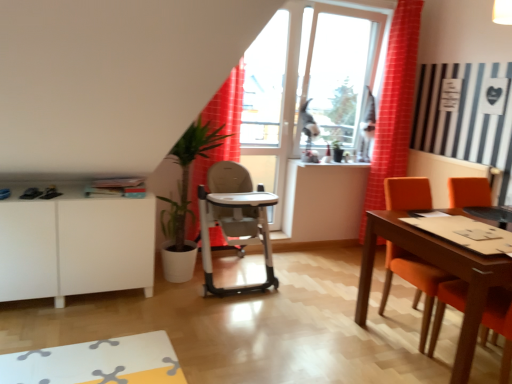
What do you see at coordinates (413, 281) in the screenshot? I see `matte orange chair at right` at bounding box center [413, 281].

Describe the element at coordinates (188, 177) in the screenshot. The height and width of the screenshot is (384, 512). I see `green leafy plant at center` at that location.

This screenshot has height=384, width=512. Describe the element at coordinates (337, 71) in the screenshot. I see `transparent glass window at center` at that location.

The width and height of the screenshot is (512, 384). I want to click on silver metallic highchair at center, so click(x=234, y=221).

In order to click on matte orange chair at right in this screenshot , I will do `click(413, 281)`.

Is white matte cabinet at lower left completely or partially outside of transparent glass window at center?

Yes, white matte cabinet at lower left is outside of transparent glass window at center.

Based on the photo, considering the relative sizes of white matte cabinet at lower left and transparent glass window at center in the image provided, is white matte cabinet at lower left thinner than transparent glass window at center?

No.

Considering the positions of point (48, 237) and point (340, 136), is point (48, 237) closer or farther from the camera than point (340, 136)?

Point (48, 237) is closer to the camera than point (340, 136).

Looking at this image, does white matte cabinet at lower left come behind transparent glass window at center?

That is False.

Is red checkered curtain at right, which is the 1th curtain from right to left, at the right side of green leafy plant at center?

Yes, red checkered curtain at right, which is the 1th curtain from right to left, is to the right of green leafy plant at center.

Considering the sizes of objects red checkered curtain at right, which is the 1th curtain from right to left, and green leafy plant at center in the image provided, who is wider, red checkered curtain at right, which is the 1th curtain from right to left, or green leafy plant at center?

green leafy plant at center is wider.

From the image's perspective, is red checkered curtain at right, which is the 1th curtain from right to left, positioned above or below green leafy plant at center?

From the image's perspective, red checkered curtain at right, which is the 1th curtain from right to left, appears above green leafy plant at center.

Is transparent glass window at center oriented towards matte orange chair at right?

Yes, transparent glass window at center is turned towards matte orange chair at right.

Is transparent glass window at center wider than matte orange chair at right?

No.

Between transparent glass window at center and matte orange chair at right, which one has more height?

Standing taller between the two is transparent glass window at center.

Visually, is transparent glass window at center positioned to the left or to the right of matte orange chair at right?

From the image, it's evident that transparent glass window at center is to the left of matte orange chair at right.

Is red fabric curtain at center, which is counted as the 2th curtain, starting from the right, further to camera compared to white matte cabinet at lower left?

Yes, the depth of red fabric curtain at center, which is counted as the 2th curtain, starting from the right, is greater than that of white matte cabinet at lower left.

Does red fabric curtain at center, which ranks as the 1th curtain in left-to-right order, have a smaller size compared to white matte cabinet at lower left?

Correct, red fabric curtain at center, which ranks as the 1th curtain in left-to-right order, occupies less space than white matte cabinet at lower left.

Is red fabric curtain at center, which is counted as the 2th curtain, starting from the right, not inside white matte cabinet at lower left?

red fabric curtain at center, which is counted as the 2th curtain, starting from the right, lies outside white matte cabinet at lower left's area.

Is white matte cabinet at lower left to the left of matte orange chair at right from the viewer's perspective?

Yes.

Considering the relative sizes of white matte cabinet at lower left and matte orange chair at right in the image provided, is white matte cabinet at lower left shorter than matte orange chair at right?

Yes.

Find the location of `cabinetry behind the matte orange chair at right`. cabinetry behind the matte orange chair at right is located at coordinates (75, 246).

Is white matte cabinet at lower left oriented away from matte orange chair at right?

That's not correct — white matte cabinet at lower left is not looking away from matte orange chair at right.

From a real-world perspective, which object rests below the other?

silver metallic highchair at center is physically lower.

Is red checkered curtain at right, positioned as the second curtain in left-to-right order, positioned before silver metallic highchair at center?

No, red checkered curtain at right, positioned as the second curtain in left-to-right order, is further to the viewer.

Is red checkered curtain at right, which is the 1th curtain from right to left, oriented towards silver metallic highchair at center?

No, red checkered curtain at right, which is the 1th curtain from right to left, is not facing towards silver metallic highchair at center.

From the image's perspective, relative to silver metallic highchair at center, is red checkered curtain at right, which is the 1th curtain from right to left, above or below?

red checkered curtain at right, which is the 1th curtain from right to left, is situated higher than silver metallic highchair at center in the image.

Is red checkered curtain at right, positioned as the second curtain in left-to-right order, oriented away from red fabric curtain at center, which is counted as the 2th curtain, starting from the right?

No, red checkered curtain at right, positioned as the second curtain in left-to-right order, is not facing the opposite direction of red fabric curtain at center, which is counted as the 2th curtain, starting from the right.

Is red checkered curtain at right, positioned as the second curtain in left-to-right order, far away from red fabric curtain at center, which ranks as the 1th curtain in left-to-right order?

Yes, red checkered curtain at right, positioned as the second curtain in left-to-right order, and red fabric curtain at center, which ranks as the 1th curtain in left-to-right order, are quite far apart.

Is red checkered curtain at right, which is the 1th curtain from right to left, behind red fabric curtain at center, which ranks as the 1th curtain in left-to-right order?

Yes, the depth of red checkered curtain at right, which is the 1th curtain from right to left, is greater than that of red fabric curtain at center, which ranks as the 1th curtain in left-to-right order.

Can we say red checkered curtain at right, which is the 1th curtain from right to left, lies outside red fabric curtain at center, which ranks as the 1th curtain in left-to-right order?

Absolutely, red checkered curtain at right, which is the 1th curtain from right to left, is external to red fabric curtain at center, which ranks as the 1th curtain in left-to-right order.

Where is `window screen lying on the right of white matte cabinet at lower left`? The image size is (512, 384). window screen lying on the right of white matte cabinet at lower left is located at coordinates (337, 71).

You are a GUI agent. You are given a task and a screenshot of the screen. Output one action in this format:
    pyautogui.click(x=<x>, y=<y>)
    Task: Click on the 2nd curtain behind the green leafy plant at center, starting your count from the anchor
    The image size is (512, 384).
    Given the screenshot: What is the action you would take?
    pyautogui.click(x=394, y=106)

Which object lies further to the anchor point transparent glass window at center, green leafy plant at center or white matte cabinet at lower left?

white matte cabinet at lower left.

Based on their spatial positions, is red checkered curtain at right, positioned as the second curtain in left-to-right order, or matte orange chair at right further from green leafy plant at center?

red checkered curtain at right, positioned as the second curtain in left-to-right order, is further to green leafy plant at center.

Estimate the real-world distances between objects in this image. Which object is closer to transparent glass window at center, red fabric curtain at center, which ranks as the 1th curtain in left-to-right order, or white matte cabinet at lower left?

red fabric curtain at center, which ranks as the 1th curtain in left-to-right order, is positioned closer to the anchor transparent glass window at center.

When comparing their distances from transparent glass window at center, does red checkered curtain at right, positioned as the second curtain in left-to-right order, or green leafy plant at center seem closer?

red checkered curtain at right, positioned as the second curtain in left-to-right order, is closer to transparent glass window at center.

Considering their positions, is red fabric curtain at center, which ranks as the 1th curtain in left-to-right order, positioned closer to silver metallic highchair at center than transparent glass window at center?

red fabric curtain at center, which ranks as the 1th curtain in left-to-right order, lies closer to silver metallic highchair at center than the other object.

Looking at this image, based on their spatial positions, is matte orange chair at right or red fabric curtain at center, which is counted as the 2th curtain, starting from the right, further from white matte cabinet at lower left?

matte orange chair at right.

Considering their positions, is red checkered curtain at right, positioned as the second curtain in left-to-right order, positioned closer to green leafy plant at center than transparent glass window at center?

Based on the image, transparent glass window at center appears to be nearer to green leafy plant at center.

Based on their spatial positions, is white matte cabinet at lower left or red checkered curtain at right, positioned as the second curtain in left-to-right order, further from silver metallic highchair at center?

red checkered curtain at right, positioned as the second curtain in left-to-right order, is further to silver metallic highchair at center.

Locate an element on the screen. window screen located between white matte cabinet at lower left and matte orange chair at right in the left-right direction is located at coordinates (337, 71).

Identify the location of window screen located between red fabric curtain at center, which ranks as the 1th curtain in left-to-right order, and matte orange chair at right in the left-right direction. This screenshot has width=512, height=384. (337, 71).

Where is `chair located between silver metallic highchair at center and red checkered curtain at right, which is the 1th curtain from right to left, in the left-right direction`? This screenshot has width=512, height=384. chair located between silver metallic highchair at center and red checkered curtain at right, which is the 1th curtain from right to left, in the left-right direction is located at coordinates (413, 281).

Where is `chair between white matte cabinet at lower left and red checkered curtain at right, which is the 1th curtain from right to left`? This screenshot has width=512, height=384. chair between white matte cabinet at lower left and red checkered curtain at right, which is the 1th curtain from right to left is located at coordinates (413, 281).